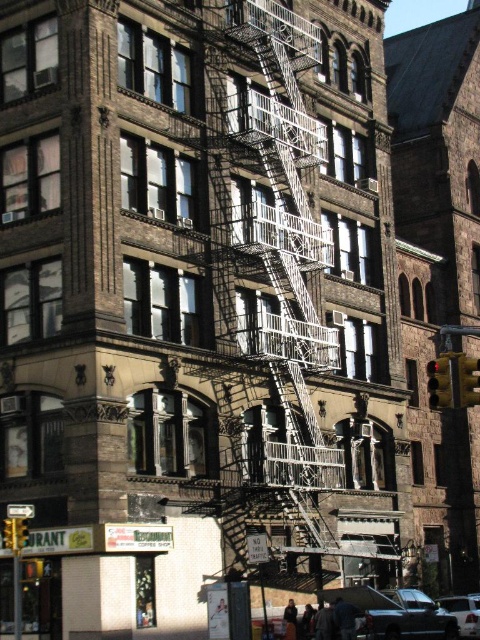
You are standing 50 meters away from the building. You want to reach the point at coordinates point (364, 628). Can you walk forward 5 meters and then reach the point?

The distance of point (364, 628) from viewer is 44.43 meters. Since you are currently 50 meters away, walking forward 5 meters would bring you to 45 meters away, which is still 0.57 meters short of the required distance. Therefore, you need to walk a bit further to reach the point.